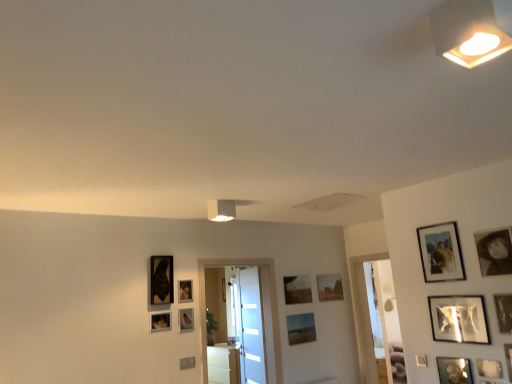
Question: Would you say metallic reflective picture frame at right, which is counted as the 5th picture frame, starting from the right, is to the left or to the right of transparent glass door at center, the 2th glass door from the left, in the picture?

Choices:
 (A) left
 (B) right

Answer: (B)

Question: From the image's perspective, relative to transparent glass door at center, the 2th glass door from the left, is metallic reflective picture frame at right, arranged as the 10th picture frame when viewed from the back, above or below?

Choices:
 (A) above
 (B) below

Answer: (A)

Question: Which of these objects is positioned closest to the metallic silver picture frame at lower right, the 6th picture frame from the front?

Choices:
 (A) matte wooden picture frame at center, which is the 13th picture frame from front to back
 (B) metallic reflective picture frame at right, which is counted as the 5th picture frame, starting from the right
 (C) matte black picture frame at upper right, marked as the thirteenth picture frame in a left-to-right arrangement
 (D) matte black picture frame at center, the 11th picture frame when ordered from right to left
 (E) matte black picture frame at lower left, the 7th picture frame from the back

Answer: (B)

Question: Which of these objects is positioned closest to the matte brown picture frame at upper center, placed as the 14th picture frame when sorted from front to back?

Choices:
 (A) black matte picture frame at upper right, the third picture frame positioned from the right
 (B) metallic silver picture frame at right, which ranks as the 1th picture frame in right-to-left order
 (C) matte wooden picture frame at center, marked as the 10th picture frame in a right-to-left arrangement
 (D) matte wooden picture frame at upper right, marked as the seventh picture frame in a right-to-left arrangement
 (E) matte black picture frame at upper right, positioned as the 13th picture frame in back-to-front order

Answer: (C)